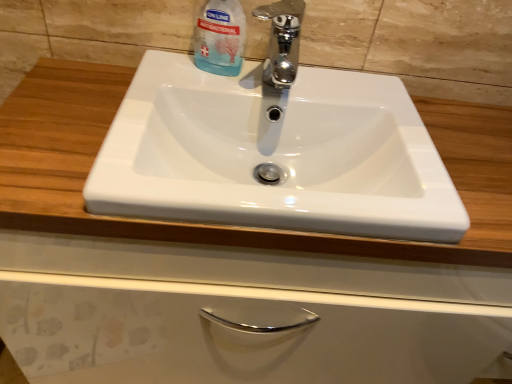
This screenshot has height=384, width=512. Find the location of `vacant space in front of transparent plastic bottle at upper center`. vacant space in front of transparent plastic bottle at upper center is located at coordinates (189, 93).